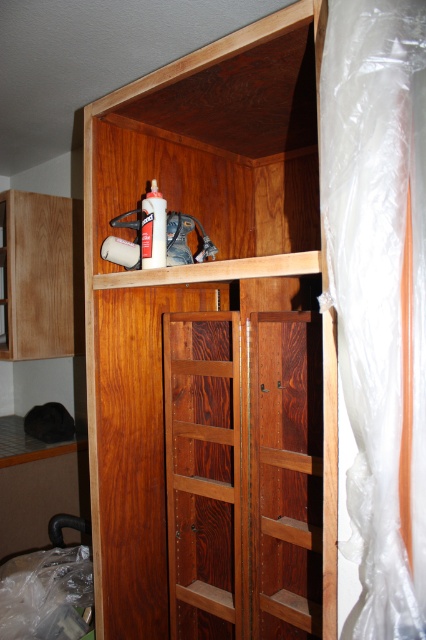
Based on the photo, you are a carpenter working on assembling a cabinet. You have a matte white spray can at upper center and a wooden cabinet at upper center. You need to spray paint the cabinet. Can you reach both items without moving your position if your arm can extend 15 inches?

The wooden cabinet at upper center and the matte white spray can at upper center are 15.60 inches apart. Since your arm can only extend 15 inches, you cannot reach both items without moving your position because the distance between them exceeds your arm length.

You are an interior designer assessing the placement of items on a wooden cabinet at upper center. You notice a matte white spray can at upper center nearby. Based on the spatial arrangement, which item is positioned higher?

The matte white spray can at upper center is positioned higher than the wooden cabinet at upper center since it is above it.

You are an interior designer who needs to place a 36 inch long decorative item between the matte wood shelf at left and the matte white spray can at upper center. Can this item fit in the available space?

The distance between the matte wood shelf at left and the matte white spray can at upper center is 37.12 inches. Since the decorative item is 36 inches long, it can fit within the available space as there is 1.12 inches of extra space.